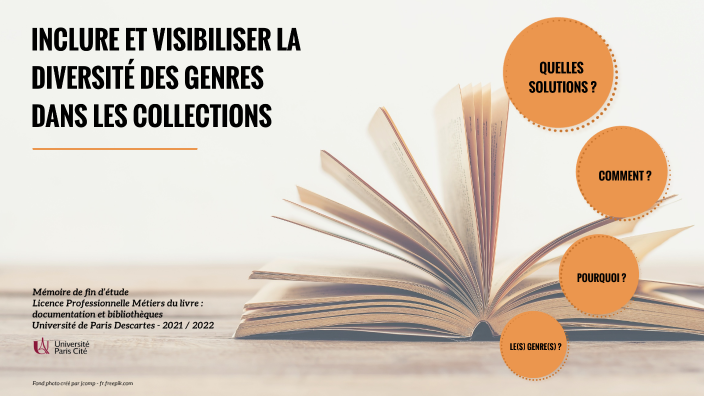
This screenshot has height=396, width=704. Find the location of `table`. table is located at coordinates (346, 368).